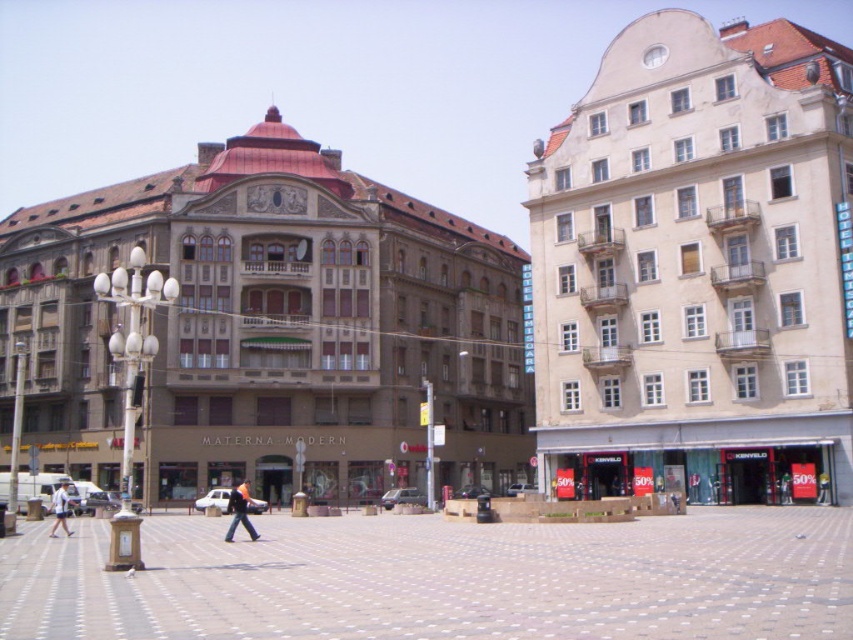
Question: Does denim pants at center lie in front of white cotton shirt at center?

Choices:
 (A) yes
 (B) no

Answer: (A)

Question: Is denim pants at center to the left of white cotton shirt at center from the viewer's perspective?

Choices:
 (A) no
 (B) yes

Answer: (A)

Question: Is denim pants at center bigger than white cotton shirt at center?

Choices:
 (A) no
 (B) yes

Answer: (B)

Question: Which object appears closest to the camera in this image?

Choices:
 (A) white cotton shirt at center
 (B) denim pants at center

Answer: (B)